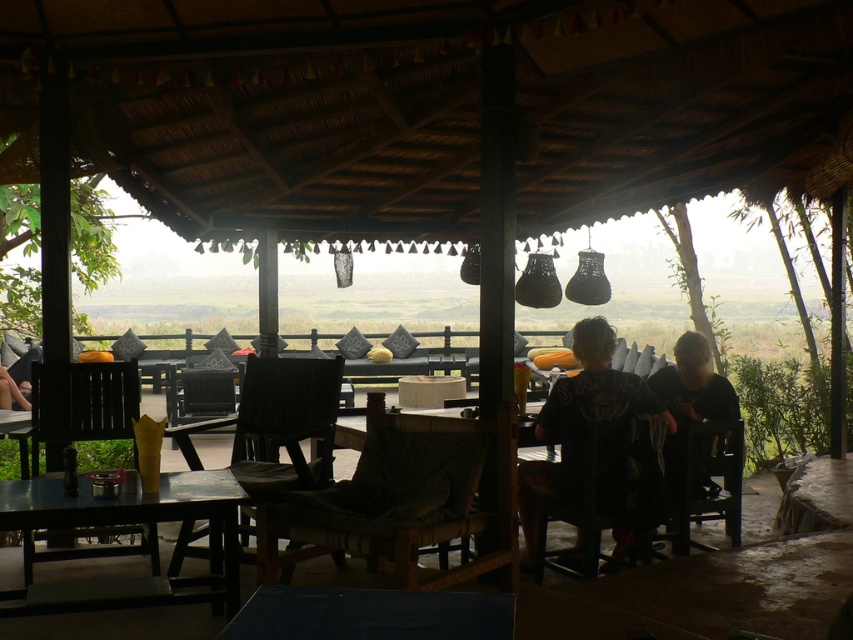
Question: Considering the real-world distances, which object is farthest from the black wood chair at lower left?

Choices:
 (A) dark brown leather chair at lower left
 (B) black wooden chair at center
 (C) woven brown chair at center
 (D) dark wood chair at center

Answer: (B)

Question: Which point is closer to the camera?

Choices:
 (A) (80, 488)
 (B) (645, 403)
 (C) (463, 520)
 (D) (672, 365)

Answer: (A)

Question: Does black wood chair at lower left come in front of black fabric shirt at lower right?

Choices:
 (A) yes
 (B) no

Answer: (A)

Question: Is dark wood chair at center smaller than black wood chair at lower left?

Choices:
 (A) yes
 (B) no

Answer: (B)

Question: Among these points, which one is farthest from the camera?

Choices:
 (A) (0, 406)
 (B) (202, 486)

Answer: (A)

Question: Observing the image, what is the correct spatial positioning of woven brown chair at center in reference to dark brown leather jacket at center?

Choices:
 (A) right
 (B) left

Answer: (B)